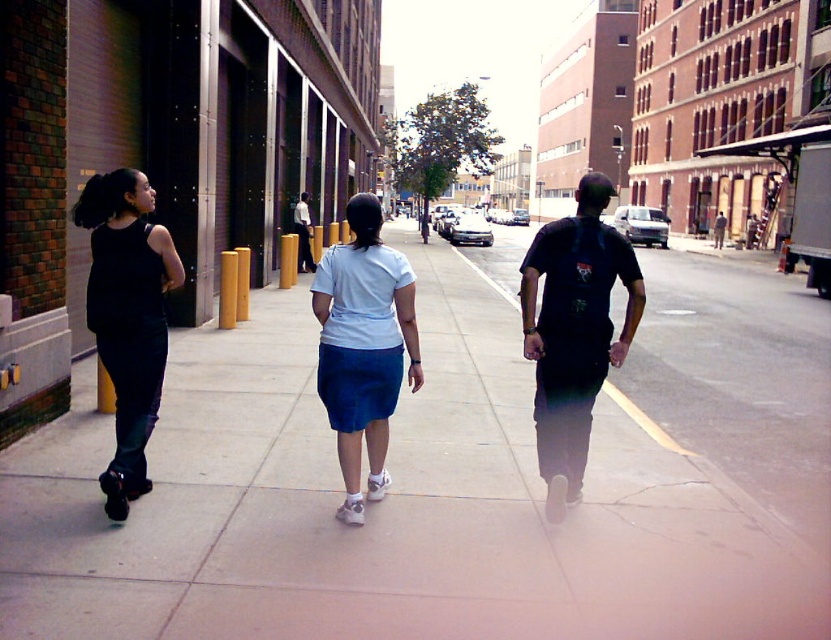
Question: Which point is farther from the camera taking this photo?

Choices:
 (A) tap(342, 404)
 (B) tap(534, 273)
 (C) tap(107, 289)
 (D) tap(829, 589)

Answer: (B)

Question: Among these objects, which one is nearest to the camera?

Choices:
 (A) white matte skirt at center
 (B) matte black tank top at left

Answer: (B)

Question: Does smooth concrete sidewalk at center appear on the right side of white matte skirt at center?

Choices:
 (A) yes
 (B) no

Answer: (A)

Question: Can you confirm if dark blue backpack at center is positioned to the right of white matte skirt at center?

Choices:
 (A) yes
 (B) no

Answer: (A)

Question: Does dark blue backpack at center come in front of matte black tank top at left?

Choices:
 (A) no
 (B) yes

Answer: (A)

Question: Which point is closer to the camera?

Choices:
 (A) white matte skirt at center
 (B) dark blue backpack at center

Answer: (B)